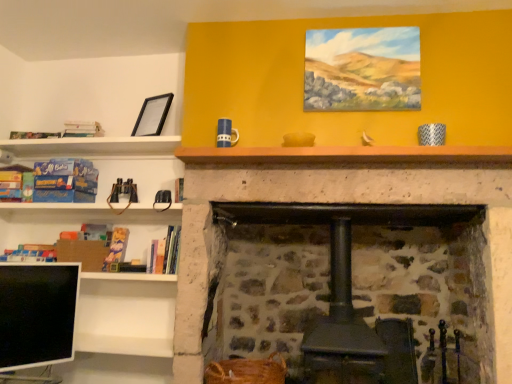
Question: Is black glossy computer monitor at lower left to the left or to the right of hardcover book at left, which is the seventh book from left to right, in the image?

Choices:
 (A) left
 (B) right

Answer: (A)

Question: Looking at the image, does black glossy computer monitor at lower left seem bigger or smaller compared to hardcover book at left, the first book when ordered from right to left?

Choices:
 (A) big
 (B) small

Answer: (A)

Question: Which is nearer to the white matte bookshelf at upper left, which appears as the fourth book when viewed from the right?

Choices:
 (A) brown woven basket at lower center
 (B) black glossy computer monitor at lower left
 (C) blue cardboard box at left, the 5th book viewed from the right
 (D) hardcover book at left, which appears as the 6th book when viewed from the right
 (E) hardcover book at left, the 5th book positioned from the left

Answer: (C)

Question: Which of these objects is positioned farthest from the hardcover book at center, the 2th book viewed from the right?

Choices:
 (A) white matte bookshelf at upper left, positioned as the fourth book in left-to-right order
 (B) brown woven basket at lower center
 (C) hardcover book at left, the 5th book positioned from the left
 (D) blue cardboard box at left, which is counted as the 3th book, starting from the left
 (E) matte blue book at left, which appears as the seventh book when viewed from the right

Answer: (E)